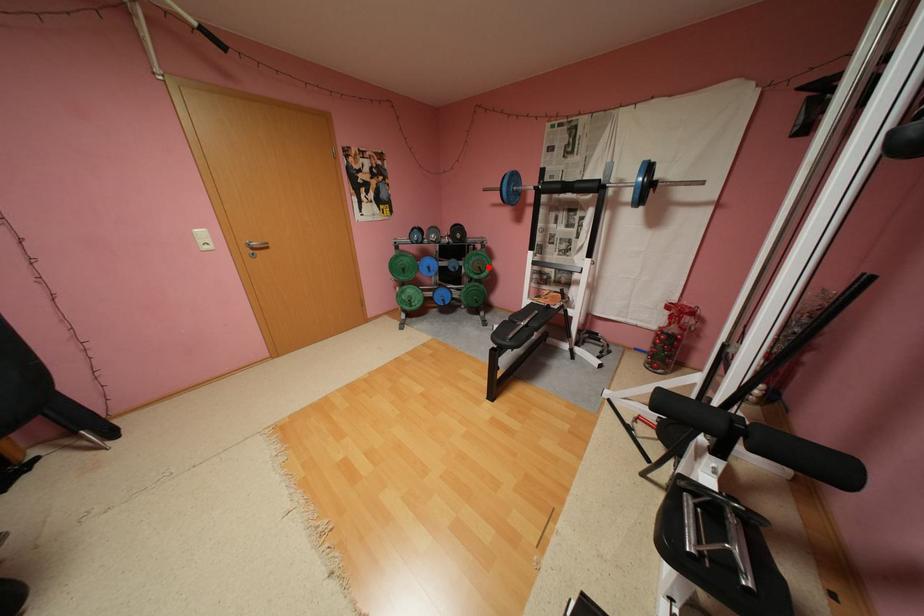
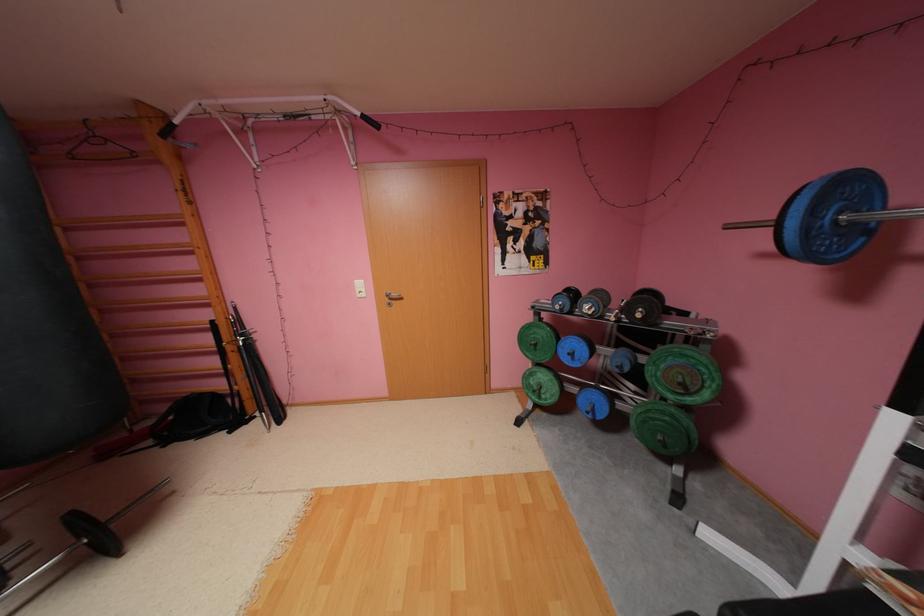
Question: I am providing you with two images of the same scene from different viewpoints. Image1 has a red point marked. In image2, the corresponding 3D location appears at what relative position? Reply with the corresponding letter.

Choices:
 (A) Closer
 (B) Farther

Answer: (B)